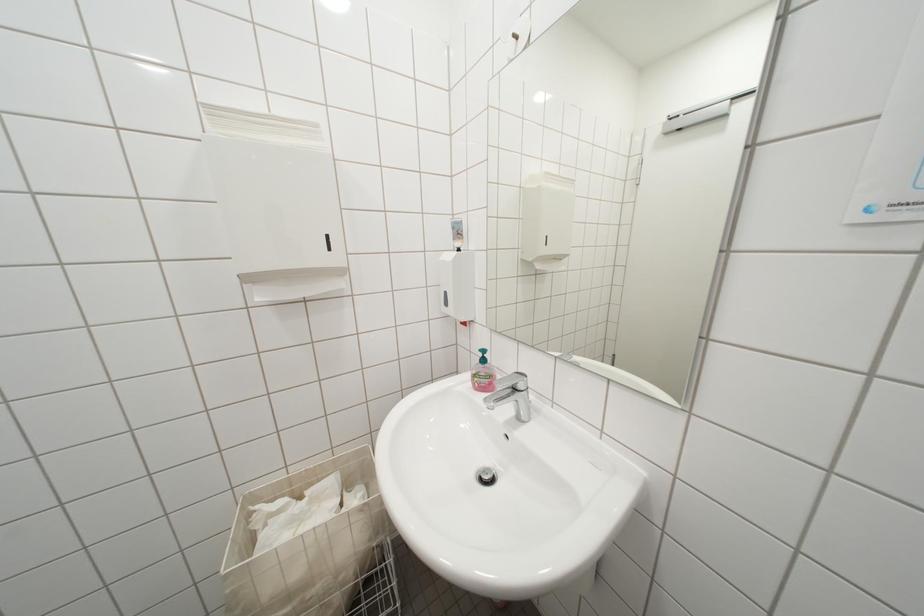
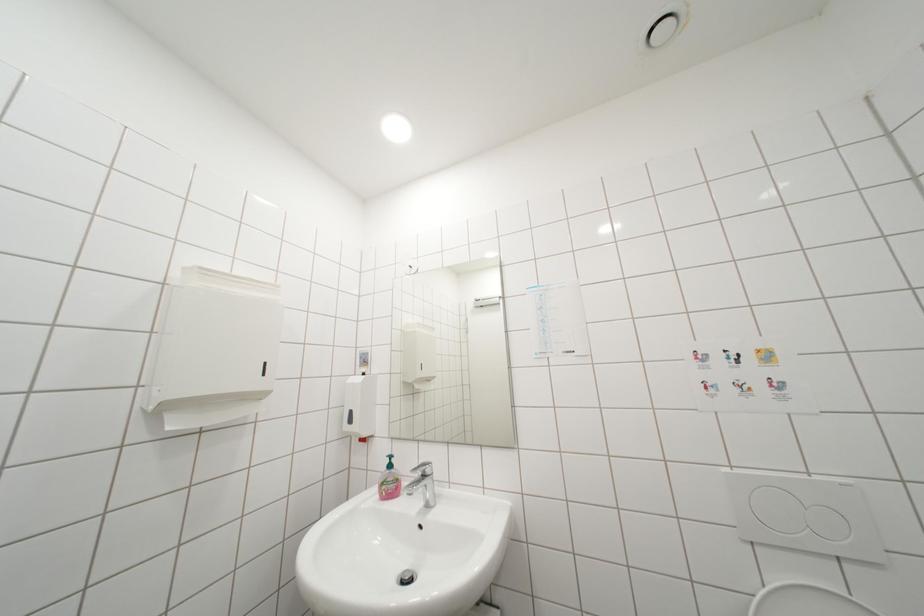
Consider the image. First-person continuous shooting, in which direction is the camera rotating?

The camera rotated toward right-up.